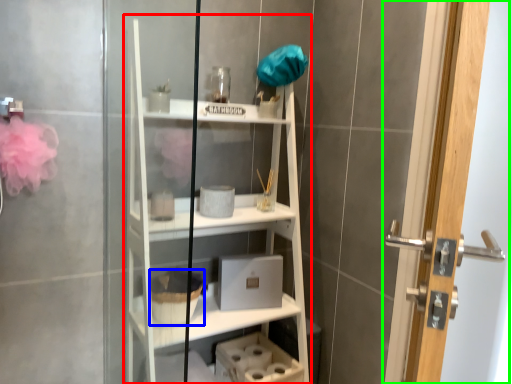
Question: Which is nearer to the bookshelf (highlighted by a red box)? basket (highlighted by a blue box) or door (highlighted by a green box).

Choices:
 (A) basket
 (B) door

Answer: (A)